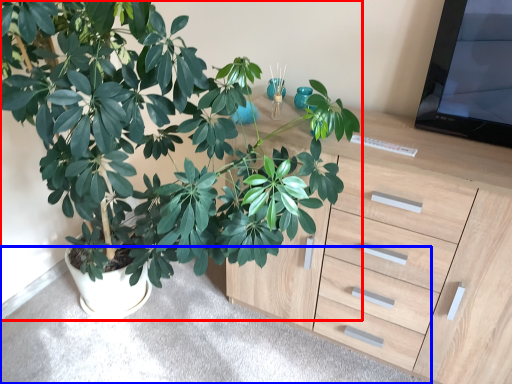
Question: Which object is further to the camera taking this photo, houseplant (highlighted by a red box) or gray (highlighted by a blue box)?

Choices:
 (A) houseplant
 (B) gray

Answer: (B)